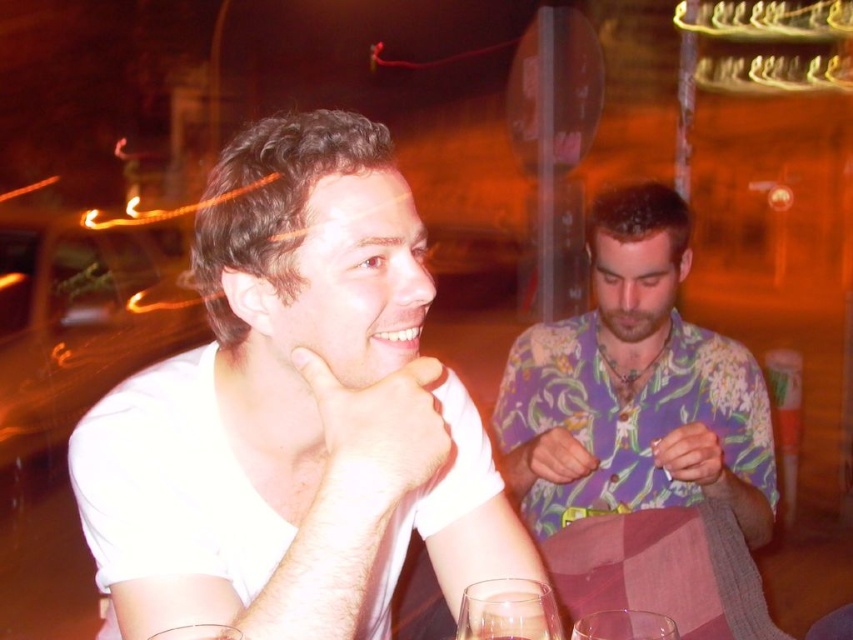
Question: Which object is positioned closest to the floral print shirt at center?

Choices:
 (A) clear glass wine glass at lower center
 (B) beardhairjaw at center

Answer: (B)

Question: Can you confirm if floral print shirt at center is positioned below beardhairjaw at center?

Choices:
 (A) no
 (B) yes

Answer: (B)

Question: From the image, what is the correct spatial relationship of white matte shirt at left in relation to floral print shirt at center?

Choices:
 (A) below
 (B) above

Answer: (A)

Question: Which of these objects is positioned farthest from the transparent glass at lower center?

Choices:
 (A) floral print shirt at center
 (B) white matte shirt at left
 (C) beardhairjaw at center
 (D) clear glass wine glass at lower center

Answer: (C)

Question: Is clear glass wine glass at lower center further to camera compared to transparent glass at lower center?

Choices:
 (A) yes
 (B) no

Answer: (A)

Question: Which of the following is the closest to the observer?

Choices:
 (A) (619, 627)
 (B) (635, 324)

Answer: (A)